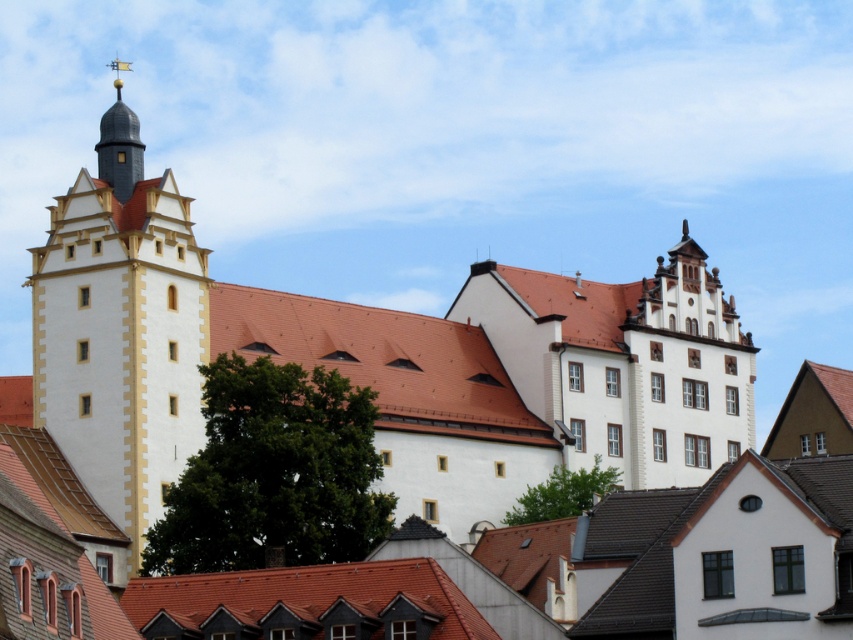
Question: Among these points, which one is farthest from the camera?

Choices:
 (A) (64, 362)
 (B) (115, 140)
 (C) (706, 284)

Answer: (C)

Question: Which of the following is the farthest from the observer?

Choices:
 (A) matte white tower at left
 (B) white matte building at center
 (C) shiny gold spire at upper left

Answer: (C)

Question: Which object is positioned closest to the shiny gold spire at upper left?

Choices:
 (A) white matte building at center
 (B) matte white tower at left

Answer: (B)

Question: Is white matte building at center positioned before shiny gold spire at upper left?

Choices:
 (A) no
 (B) yes

Answer: (B)

Question: Can you confirm if matte white tower at left is positioned below shiny gold spire at upper left?

Choices:
 (A) no
 (B) yes

Answer: (B)

Question: Is matte white tower at left to the left of shiny gold spire at upper left from the viewer's perspective?

Choices:
 (A) yes
 (B) no

Answer: (B)